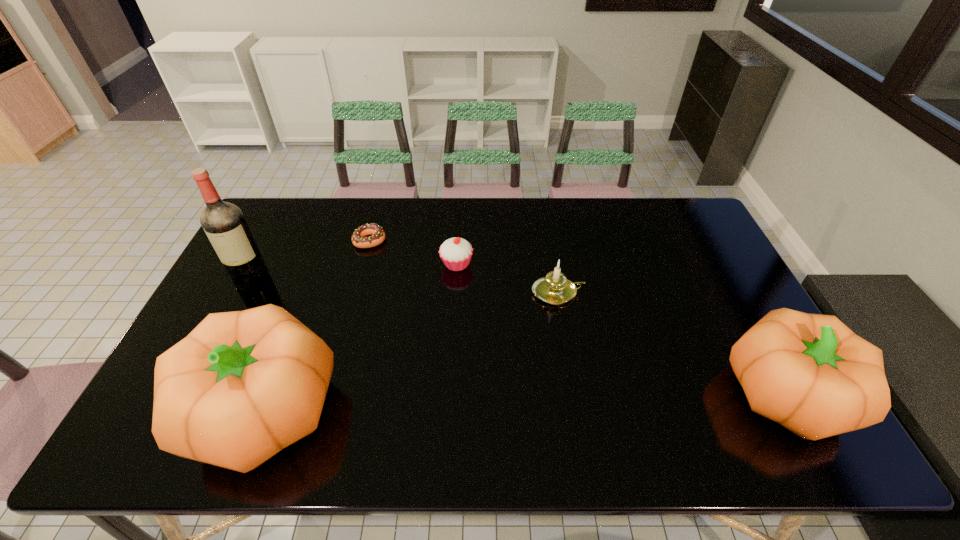
Image resolution: width=960 pixels, height=540 pixels. What are the coordinates of `object at the near left corner` in the screenshot? It's located at (243, 385).

Locate an element on the screen. object that is at the near right corner is located at coordinates (810, 373).

Where is `free space at the far edge of the desktop`? This screenshot has height=540, width=960. free space at the far edge of the desktop is located at coordinates (586, 215).

The image size is (960, 540). In order to click on blank space at the near edge of the desktop in this screenshot , I will do 347,384.

Image resolution: width=960 pixels, height=540 pixels. I want to click on vacant space at the far left corner, so click(272, 202).

Image resolution: width=960 pixels, height=540 pixels. Identify the location of vacant space at the far right corner of the desktop. (685, 217).

Locate an element on the screen. free space between the doughnut and the fifth shortest object is located at coordinates (316, 325).

The image size is (960, 540). I want to click on free space between the left pumpkin and the shorter pumpkin, so click(x=525, y=401).

Find the location of `free space between the shorter pumpkin and the farthest object`. free space between the shorter pumpkin and the farthest object is located at coordinates [x=580, y=316].

At what (x,y) coordinates should I click in order to perform the action: click on unoccupied area between the taller pumpkin and the second object from right to left. Please return your answer as a coordinate pair (x, y). This screenshot has height=540, width=960. Looking at the image, I should click on (409, 351).